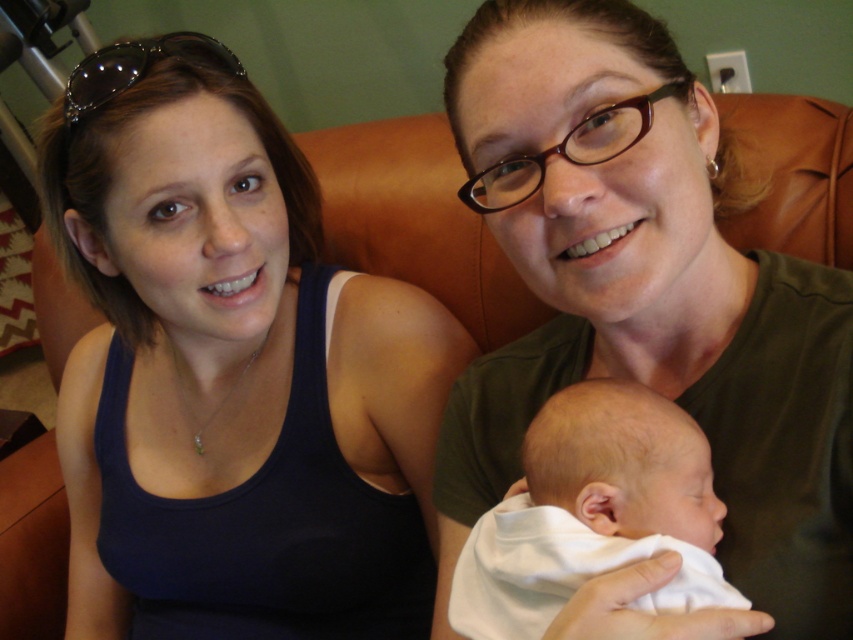
Where is the matte black tank top at left located in the image?

The matte black tank top at left is located at point [231,371] in the image.

You are trying to decide whether to place a new decorative item on the table next to the matte black tank top at left and the white soft baby at center. If the table has just enough space for one of them, which item should you choose based on their widths?

The matte black tank top at left might be wider than the white soft baby at center, so you should choose the matte black tank top at left to place on the table since it requires more space.